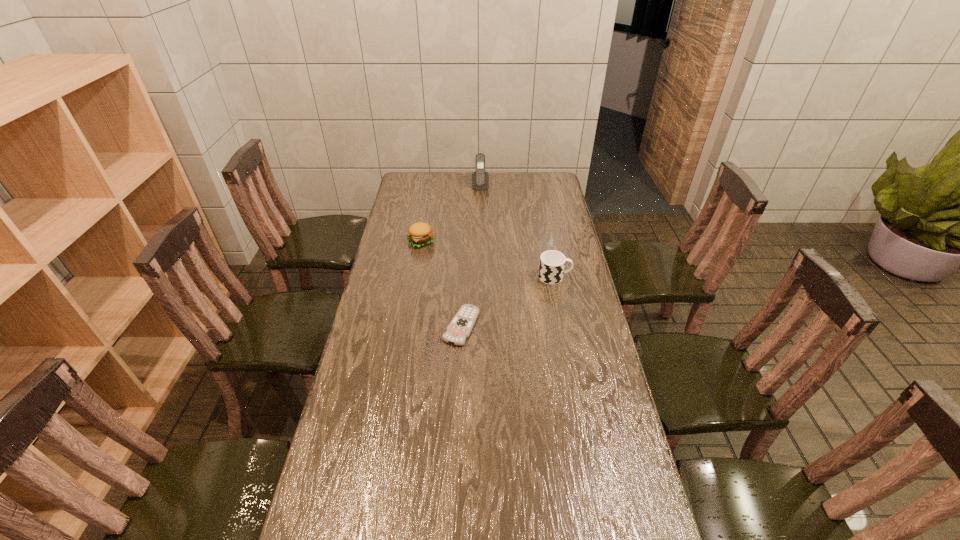
Find the location of a particular element. The width and height of the screenshot is (960, 540). the farthest object is located at coordinates (480, 179).

The width and height of the screenshot is (960, 540). In order to click on the tallest object in this screenshot , I will do `click(480, 179)`.

This screenshot has height=540, width=960. What are the coordinates of `the rightmost object` in the screenshot? It's located at (552, 263).

Where is `the third farthest object`? Image resolution: width=960 pixels, height=540 pixels. the third farthest object is located at coordinates (552, 263).

The image size is (960, 540). What are the coordinates of `the third tallest object` in the screenshot? It's located at (419, 234).

Find the location of a particular element. The width and height of the screenshot is (960, 540). hamburger is located at coordinates (419, 234).

Locate an element on the screen. The width and height of the screenshot is (960, 540). the nearest object is located at coordinates (460, 327).

I want to click on remote control, so click(x=460, y=327).

Identify the location of free space located 0.240m on the front-facing side of the farthest object. Image resolution: width=960 pixels, height=540 pixels. (480, 217).

This screenshot has width=960, height=540. Find the location of `vacant area situated on the side of the cup with the handle`. vacant area situated on the side of the cup with the handle is located at coordinates (584, 277).